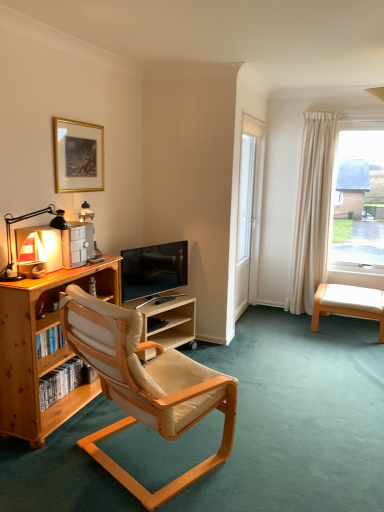
You are a GUI agent. You are given a task and a screenshot of the screen. Output one action in this format:
    pyautogui.click(x=<x>, y=<y>)
    Task: Click on the free spot in front of white glass screen door at center
    This screenshot has height=512, width=384.
    Given the screenshot: What is the action you would take?
    pyautogui.click(x=266, y=335)